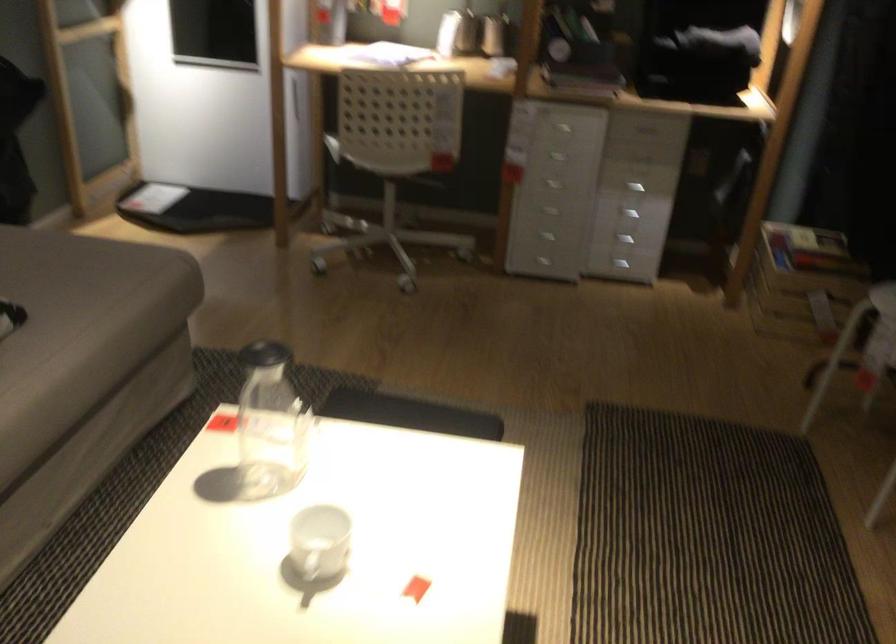
Where would you lift the black pitcher lid? Please return your answer as a coordinate pair (x, y).

(264, 354)